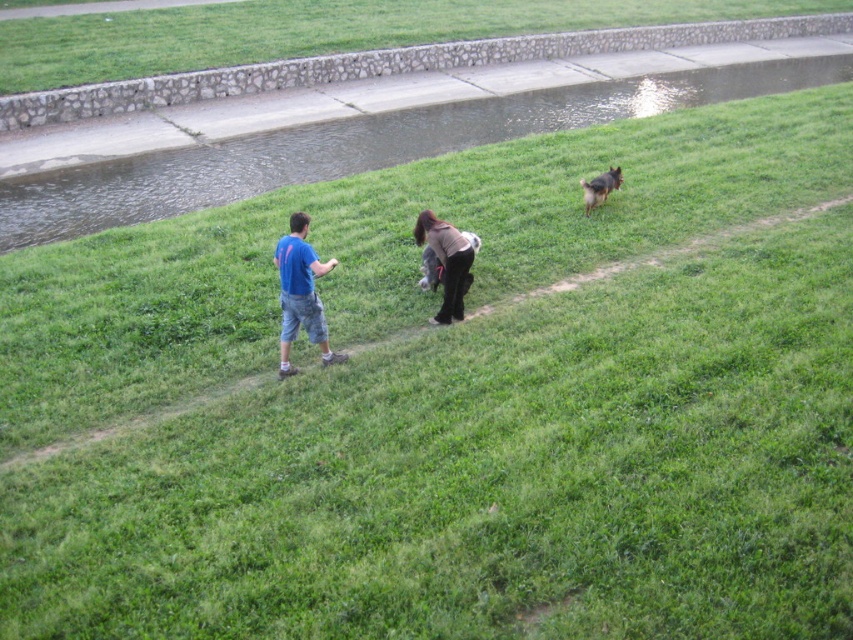
Question: Is the position of smooth concrete creek at upper center more distant than that of short-haired brown dog at center?

Choices:
 (A) no
 (B) yes

Answer: (B)

Question: Among these points, which one is farthest from the camera?

Choices:
 (A) (280, 269)
 (B) (167, 160)
 (C) (9, 68)

Answer: (C)

Question: Can you confirm if blue denim shorts at center is wider than dark brown sweater at center?

Choices:
 (A) no
 (B) yes

Answer: (B)

Question: Which object is positioned farthest from the dark brown sweater at center?

Choices:
 (A) green grassy at upper center
 (B) brown fur dog at upper right

Answer: (A)

Question: Estimate the real-world distances between objects in this image. Which object is closer to the smooth concrete creek at upper center?

Choices:
 (A) green grassy at upper center
 (B) blue denim shorts at center
 (C) short-haired brown dog at center
 (D) brown fur dog at upper right

Answer: (A)

Question: Is green grassy at upper center further to the viewer compared to short-haired brown dog at center?

Choices:
 (A) yes
 (B) no

Answer: (A)